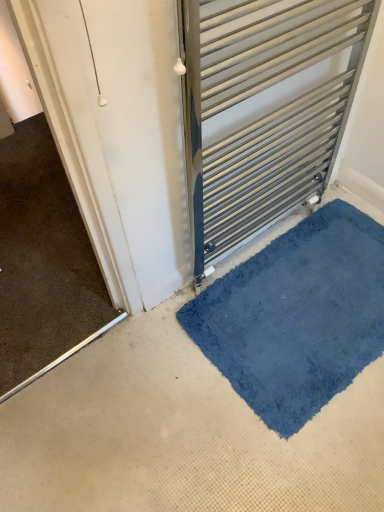
Question: From a real-world perspective, is blue plush bath mat at lower right physically below satin silver towel rack at center?

Choices:
 (A) yes
 (B) no

Answer: (A)

Question: Can you confirm if blue plush bath mat at lower right is bigger than satin silver towel rack at center?

Choices:
 (A) no
 (B) yes

Answer: (A)

Question: Considering the relative sizes of blue plush bath mat at lower right and satin silver towel rack at center in the image provided, is blue plush bath mat at lower right wider than satin silver towel rack at center?

Choices:
 (A) no
 (B) yes

Answer: (B)

Question: Is blue plush bath mat at lower right smaller than satin silver towel rack at center?

Choices:
 (A) yes
 (B) no

Answer: (A)

Question: Can you confirm if blue plush bath mat at lower right is positioned to the left of satin silver towel rack at center?

Choices:
 (A) no
 (B) yes

Answer: (A)

Question: Does blue plush bath mat at lower right have a greater height compared to satin silver towel rack at center?

Choices:
 (A) yes
 (B) no

Answer: (B)

Question: Is satin silver towel rack at center completely or partially outside of blue plush bath mat at lower right?

Choices:
 (A) yes
 (B) no

Answer: (A)

Question: Is satin silver towel rack at center next to blue plush bath mat at lower right?

Choices:
 (A) no
 (B) yes

Answer: (A)

Question: Is satin silver towel rack at center turned away from blue plush bath mat at lower right?

Choices:
 (A) no
 (B) yes

Answer: (A)

Question: Is satin silver towel rack at center bigger than blue plush bath mat at lower right?

Choices:
 (A) yes
 (B) no

Answer: (A)

Question: From a real-world perspective, is satin silver towel rack at center located beneath blue plush bath mat at lower right?

Choices:
 (A) yes
 (B) no

Answer: (B)

Question: Can you confirm if satin silver towel rack at center is wider than blue plush bath mat at lower right?

Choices:
 (A) yes
 (B) no

Answer: (B)

Question: Is satin silver towel rack at center spatially inside blue plush bath mat at lower right, or outside of it?

Choices:
 (A) inside
 (B) outside

Answer: (B)